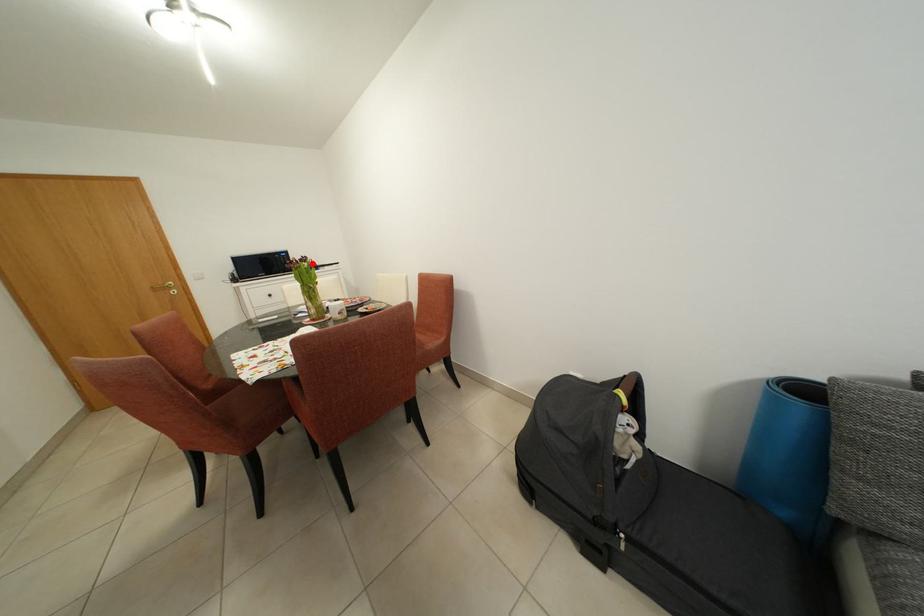
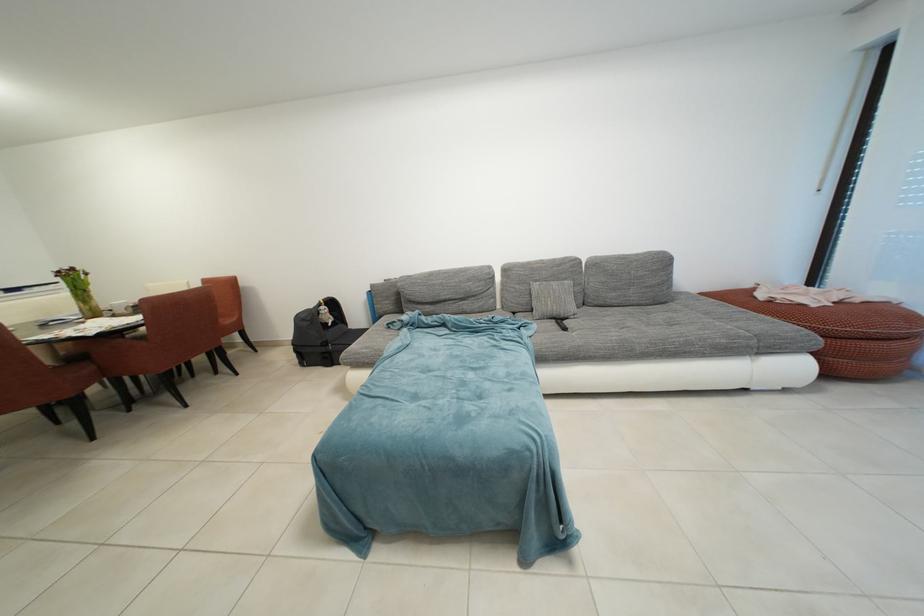
Locate, in the second image, the point that corresponds to the highlighted location in the first image.

(81, 274)